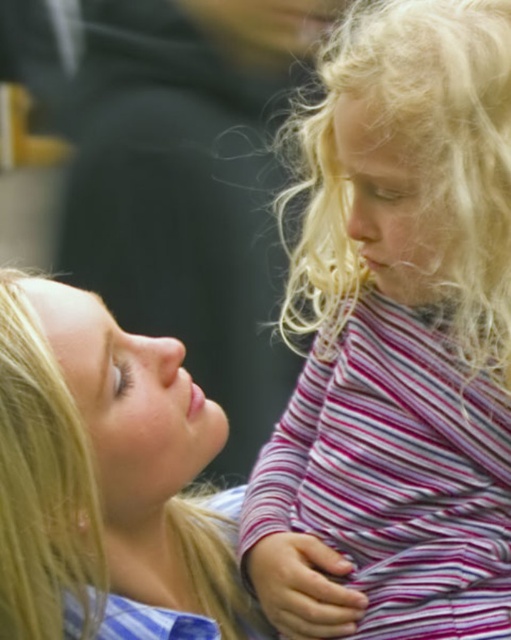
Based on the scene, which object is positioned higher in the image? The striped fabric dress at right or the blonde hair at upper left?

The striped fabric dress at right is positioned higher than the blonde hair at upper left.